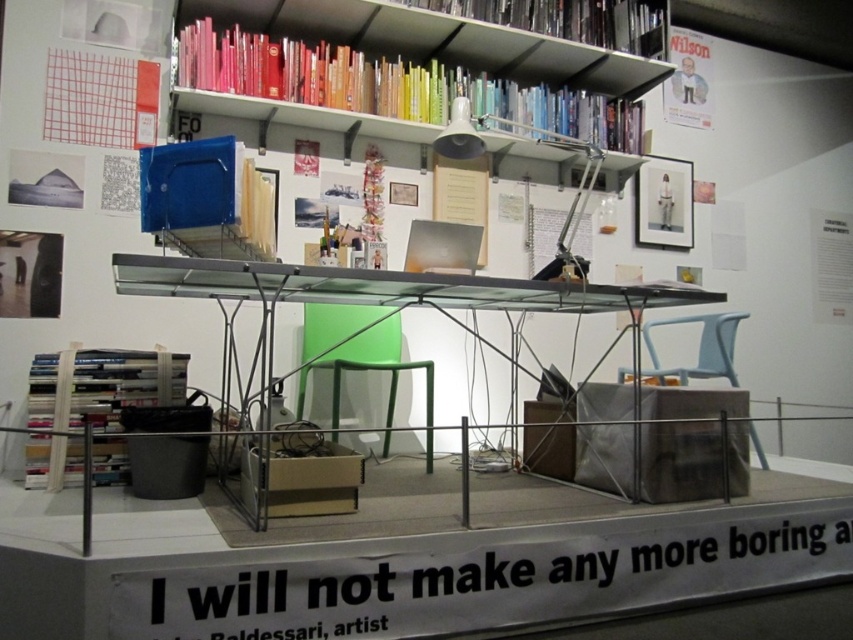
I want to click on hardcover books at upper center, so click(392, 84).

Is the position of hardcover books at upper center more distant than that of transparent glass table at center?

Yes, it is.

Where is `hardcover books at upper center`? hardcover books at upper center is located at coordinates (392, 84).

Where is `hardcover books at upper center`? The image size is (853, 640). hardcover books at upper center is located at coordinates 392,84.

Does hardcover books at upper center appear under hardcover books at lower left?

No, hardcover books at upper center is not below hardcover books at lower left.

Which is more to the left, hardcover books at upper center or hardcover books at lower left?

From the viewer's perspective, hardcover books at lower left appears more on the left side.

Which is behind, point (322, 88) or point (109, 472)?

The point (322, 88) is more distant.

At what (x,y) coordinates should I click in order to perform the action: click on hardcover books at upper center. Please return your answer as a coordinate pair (x, y). Image resolution: width=853 pixels, height=640 pixels. Looking at the image, I should click on (392, 84).

Does point (175, 81) come in front of point (616, 17)?

Yes, point (175, 81) is closer to viewer.

Which is behind, point (505, 115) or point (659, 49)?

Point (659, 49)

This screenshot has width=853, height=640. Find the location of `hardcover books at upper center`. hardcover books at upper center is located at coordinates (392, 84).